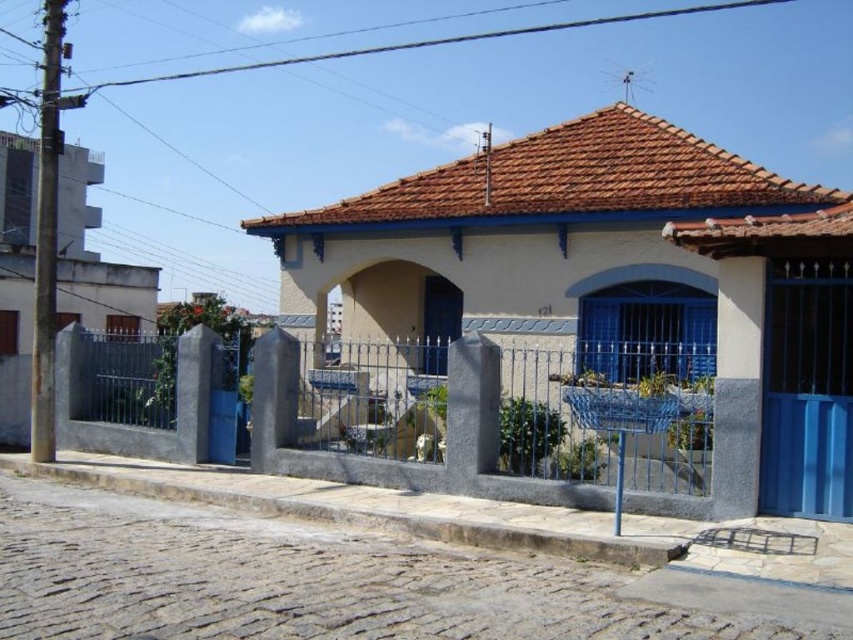
Does gray wrought iron fence at center appear under brown tile roof at upper center?

Indeed, gray wrought iron fence at center is positioned under brown tile roof at upper center.

Between gray wrought iron fence at center and brown tile roof at upper center, which one appears on the left side from the viewer's perspective?

From the viewer's perspective, gray wrought iron fence at center appears more on the left side.

Is point (480, 428) positioned behind point (451, 179)?

No, (480, 428) is in front of (451, 179).

What are the coordinates of `gray wrought iron fence at center` in the screenshot? It's located at point(397,460).